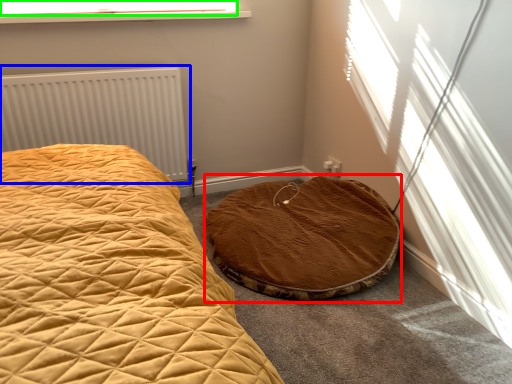
Question: Estimate the real-world distances between objects in this image. Which object is farther from cat bed (highlighted by a red box), radiator (highlighted by a blue box) or window screen (highlighted by a green box)?

Choices:
 (A) radiator
 (B) window screen

Answer: (B)